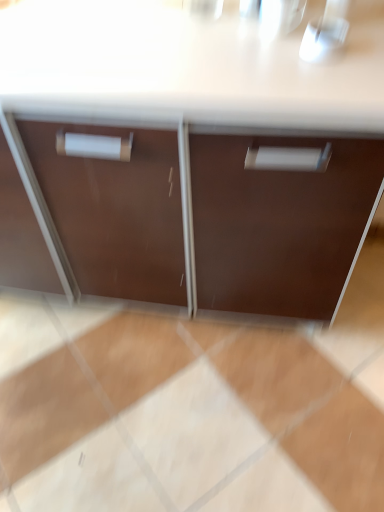
The height and width of the screenshot is (512, 384). What do you see at coordinates (180, 417) in the screenshot?
I see `matte brown tile at center` at bounding box center [180, 417].

The width and height of the screenshot is (384, 512). Identify the location of matte brown tile at center. (180, 417).

Identify the location of matte brown tile at center. (180, 417).